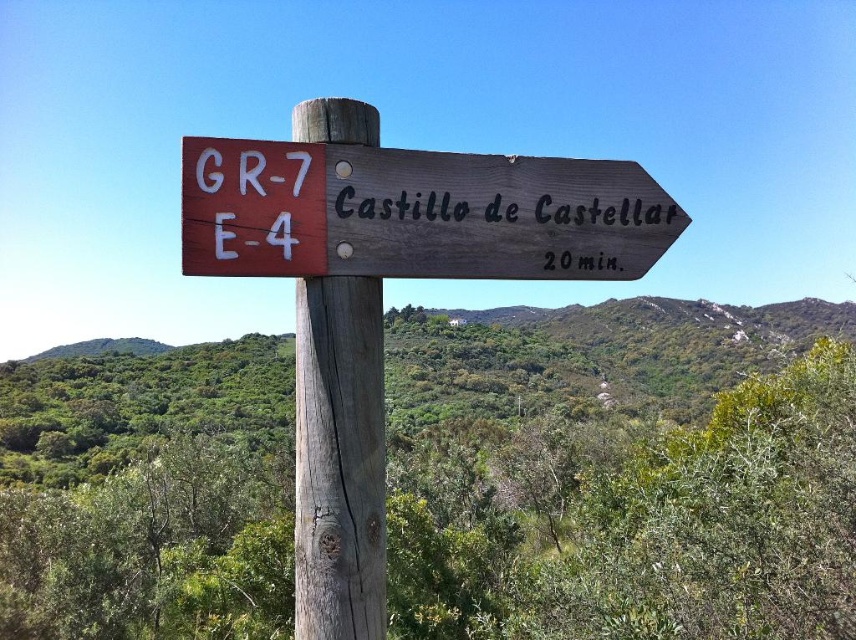
You are standing in front of the wooden signpost at center and the brown wooden sign at upper right. Which one is taller?

The wooden signpost at center is taller than the brown wooden sign at upper right.

You are a hiker trying to determine the best way to navigate around the wooden post at center and the brown wooden sign at upper right. Given their sizes, which object would require more space to maneuver around?

The brown wooden sign at upper right requires more space to maneuver around because it has a greater width than the wooden post at center.